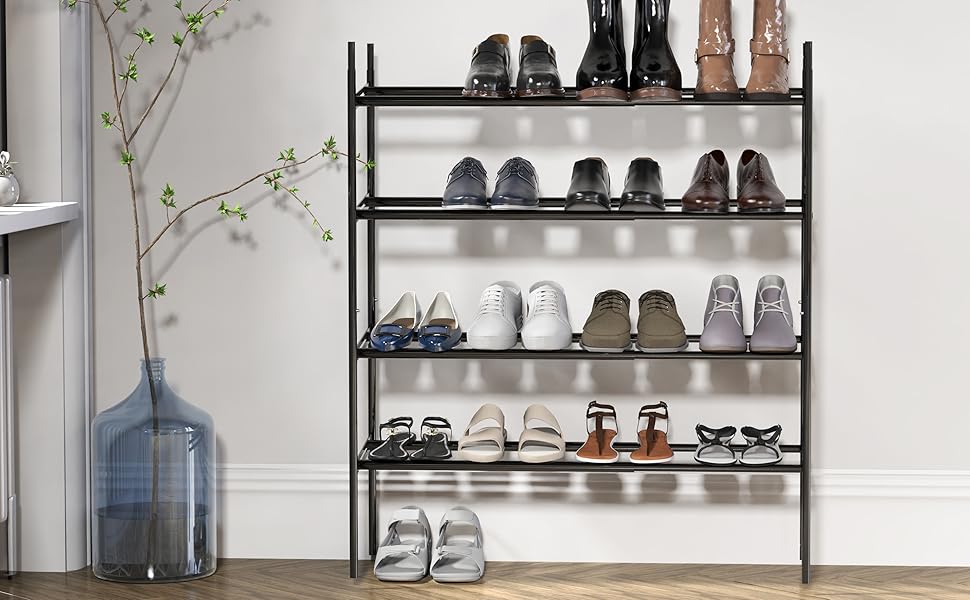
You are a GUI agent. You are given a task and a screenshot of the screen. Output one action in this format:
    pyautogui.click(x=<x>, y=<y>)
    Task: Click on the shoes on shelf above bottom shelf
    The width and height of the screenshot is (970, 600).
    Given the screenshot: What is the action you would take?
    pyautogui.click(x=391, y=332), pyautogui.click(x=434, y=332), pyautogui.click(x=491, y=326), pyautogui.click(x=551, y=326), pyautogui.click(x=607, y=334), pyautogui.click(x=654, y=334), pyautogui.click(x=722, y=329), pyautogui.click(x=770, y=336)